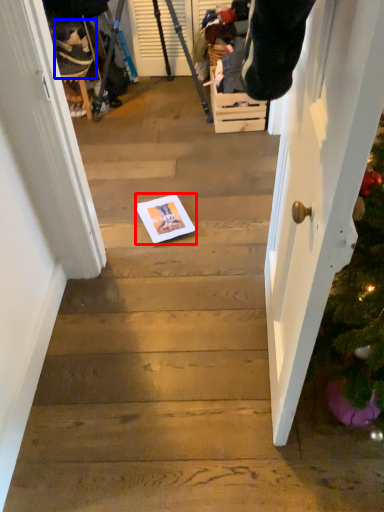
Question: Which object is further to the camera taking this photo, copy (highlighted by a red box) or person (highlighted by a blue box)?

Choices:
 (A) copy
 (B) person

Answer: (B)